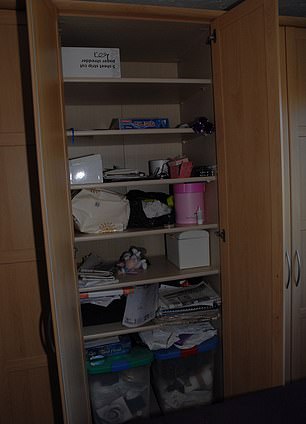
The height and width of the screenshot is (424, 306). I want to click on pink container, so click(x=193, y=203).